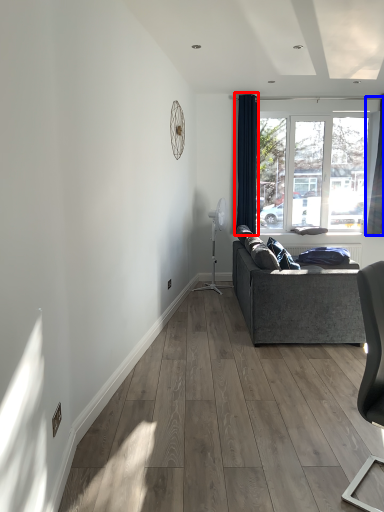
Question: Which object appears closest to the camera in this image, curtain (highlighted by a red box) or curtain (highlighted by a blue box)?

Choices:
 (A) curtain
 (B) curtain

Answer: (B)